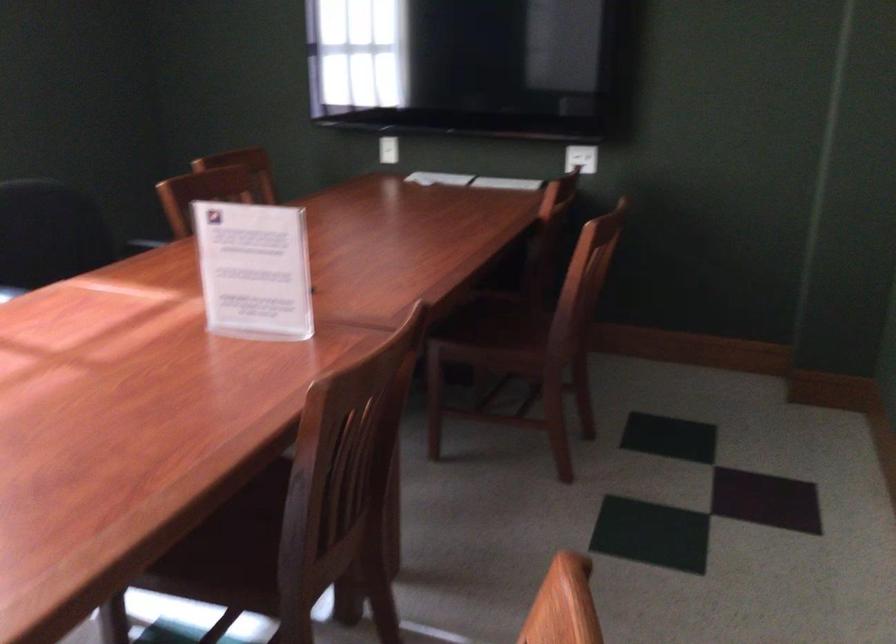
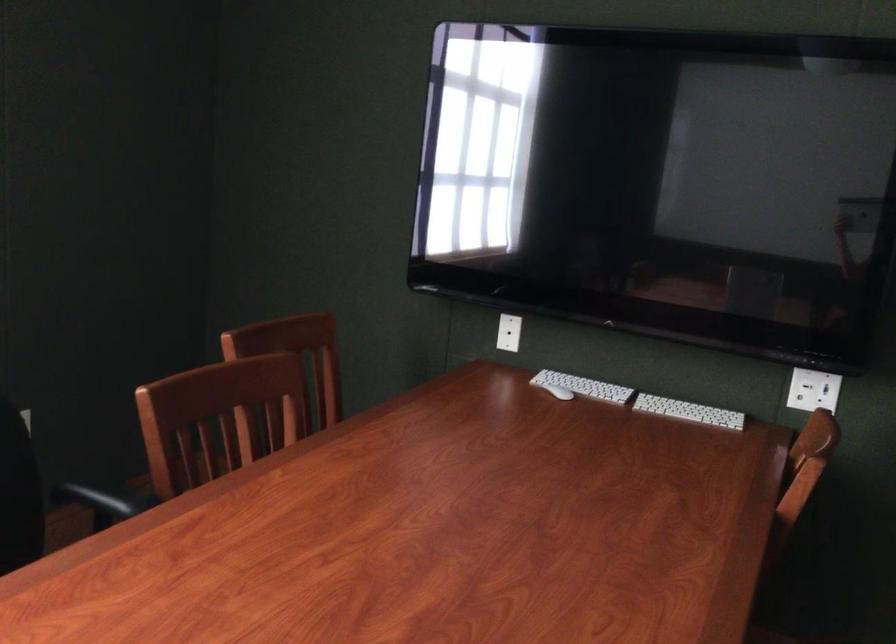
Question: What movement of the cameraman would produce the second image?

Choices:
 (A) Left
 (B) Right
 (C) Forward
 (D) Backward

Answer: (C)